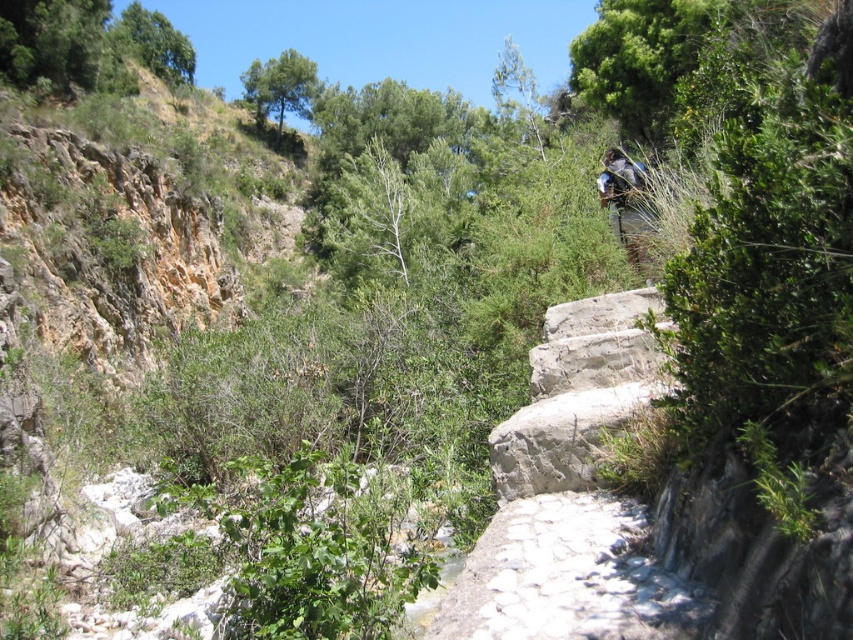
Question: Can you confirm if white stone path at center is positioned below blue fabric backpack at upper right?

Choices:
 (A) yes
 (B) no

Answer: (A)

Question: Which point is closer to the camera?

Choices:
 (A) (469, 582)
 (B) (624, 228)

Answer: (A)

Question: Is white stone path at center above blue fabric backpack at upper right?

Choices:
 (A) yes
 (B) no

Answer: (B)

Question: Among these objects, which one is nearest to the camera?

Choices:
 (A) blue fabric backpack at upper right
 (B) white stone path at center

Answer: (B)

Question: Is white stone path at center positioned before blue fabric backpack at upper right?

Choices:
 (A) yes
 (B) no

Answer: (A)